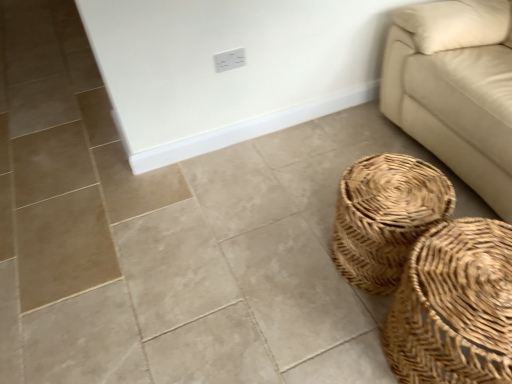
The width and height of the screenshot is (512, 384). What are the coordinates of `free space above woven natural basket at lower right, which is the 1th basket from front to back (from a real-world perspective)` in the screenshot? It's located at (466, 278).